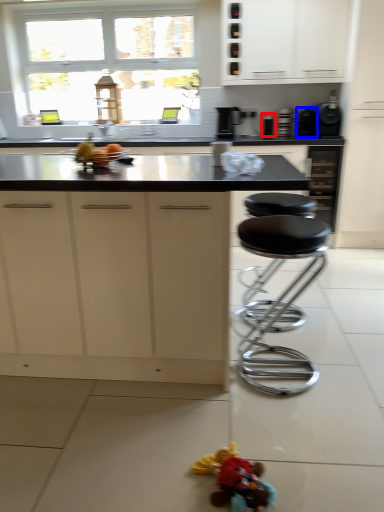
Question: Which object appears farthest to the camera in this image, appliance (highlighted by a red box) or appliance (highlighted by a blue box)?

Choices:
 (A) appliance
 (B) appliance

Answer: (A)